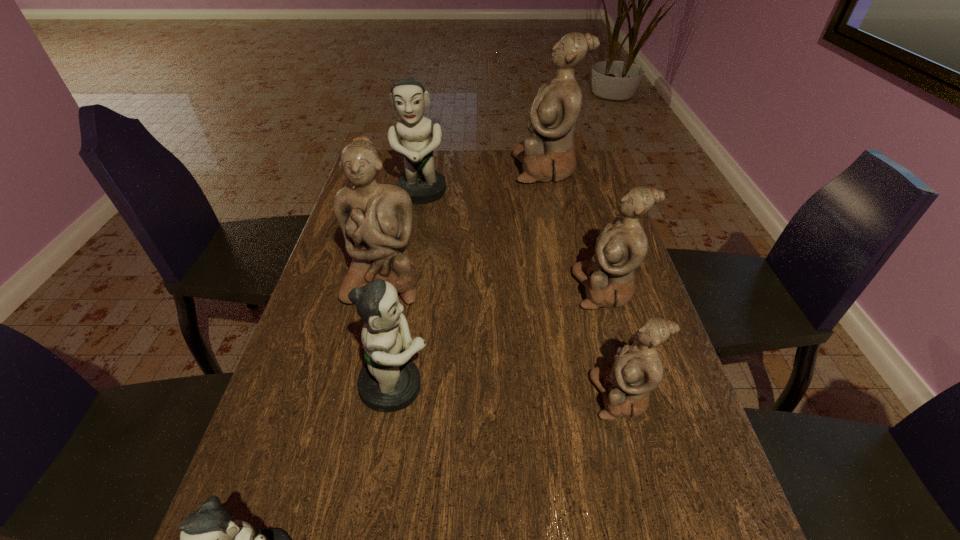
Locate an element on the screen. This screenshot has height=540, width=960. figurine that is the sixth nearest to the tallest object is located at coordinates (210, 539).

Image resolution: width=960 pixels, height=540 pixels. Find the location of `white figurine object that ranks as the closest to the second smallest white figurine`. white figurine object that ranks as the closest to the second smallest white figurine is located at coordinates (637, 369).

I want to click on white figurine that stands as the second closest to the biggest green figurine, so click(376, 219).

The image size is (960, 540). Identify the location of green figurine that stands as the closest to the second smallest white figurine. (389, 381).

Locate an element on the screen. green figurine that is the closest to the second smallest white figurine is located at coordinates (389, 381).

Locate an element on the screen. vacant point that satisfies the following two spatial constraints: 1. on the front-facing side of the farthest white figurine; 2. on the front-facing side of the leftmost white figurine is located at coordinates (571, 281).

Find the location of a particular element. The width and height of the screenshot is (960, 540). free region that satisfies the following two spatial constraints: 1. on the front-facing side of the farthest white figurine; 2. on the front-facing side of the leftmost white figurine is located at coordinates (571, 281).

The width and height of the screenshot is (960, 540). Identify the location of free space that satisfies the following two spatial constraints: 1. on the front-facing side of the biggest white figurine; 2. on the front-facing side of the third smallest white figurine. (571, 281).